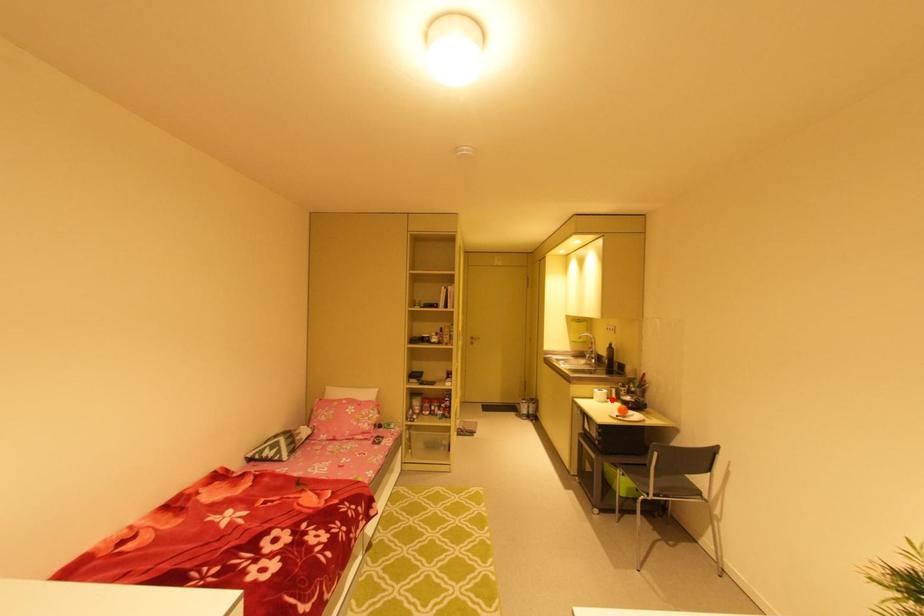
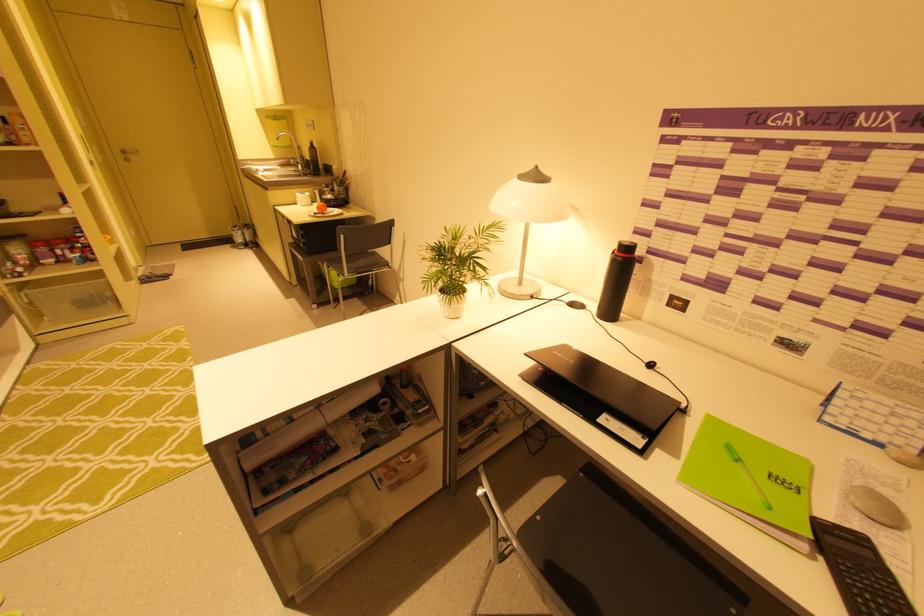
Question: I am providing you with two images of the same scene from different viewpoints. Given a red point in image1, look at the same physical point in image2. Is it:

Choices:
 (A) Closer to the viewpoint
 (B) Farther from the viewpoint

Answer: (A)